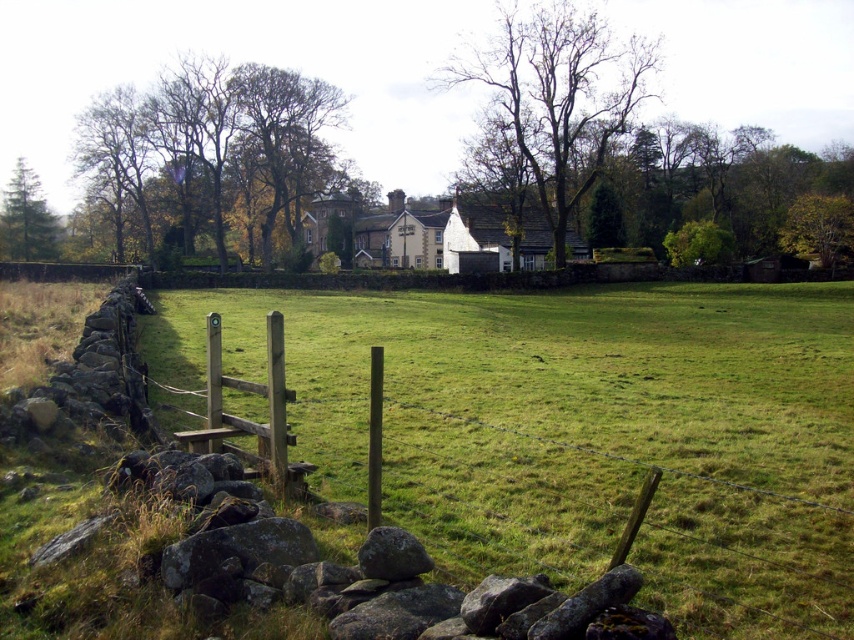
Question: Can you confirm if brown textured tree at upper center is wider than green leafy tree at upper right?

Choices:
 (A) no
 (B) yes

Answer: (B)

Question: Which of the following is the farthest from the observer?

Choices:
 (A) (852, 250)
 (B) (3, 193)

Answer: (B)

Question: Does green leafy tree at upper right have a smaller size compared to smooth gray rock at lower center?

Choices:
 (A) no
 (B) yes

Answer: (A)

Question: Which object is positioned farthest from the brown textured tree at upper center?

Choices:
 (A) green leafy tree at upper right
 (B) smooth gray rock at lower center
 (C) green textured pine tree at left

Answer: (B)

Question: Which of the following is the farthest from the observer?

Choices:
 (A) (384, 548)
 (B) (828, 221)

Answer: (B)

Question: Can you confirm if green grass at lower left is thinner than brown leafy tree at upper left?

Choices:
 (A) yes
 (B) no

Answer: (B)